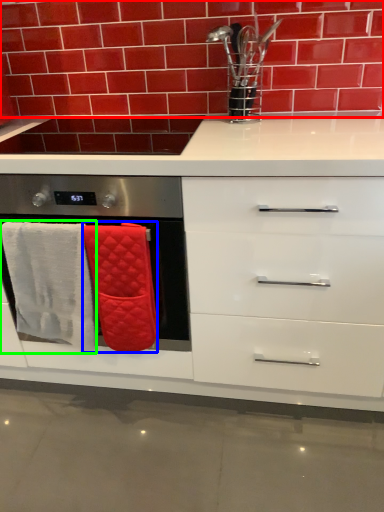
Question: Based on their relative distances, which object is nearer to brick (highlighted by a red box)? Choose from bath towel (highlighted by a blue box) and bath towel (highlighted by a green box).

Choices:
 (A) bath towel
 (B) bath towel

Answer: (B)